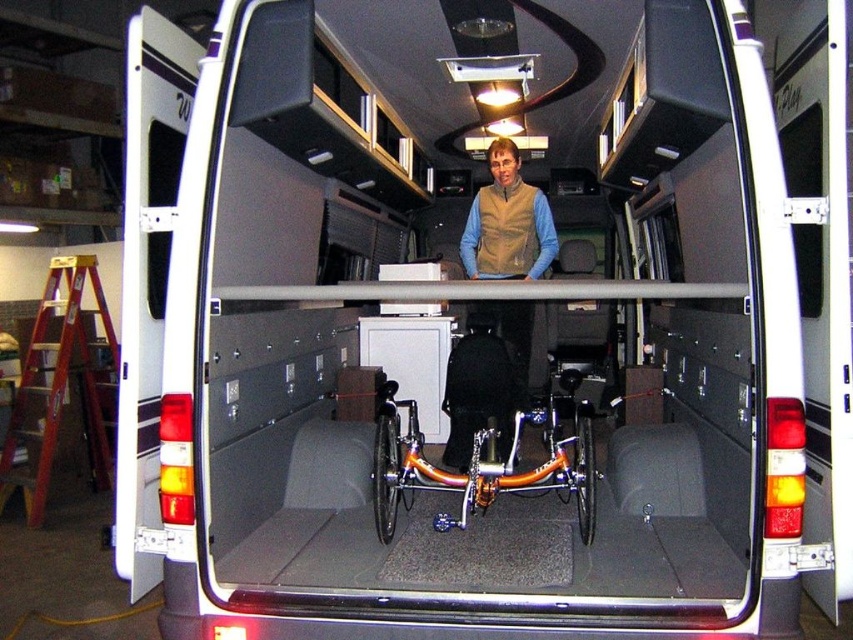
Question: Which point is farther to the camera?

Choices:
 (A) (492, 364)
 (B) (521, 248)
 (C) (68, 312)
 (D) (550, 474)

Answer: (C)

Question: Is red wood ladder at left above matte black wheelchair at center?

Choices:
 (A) yes
 (B) no

Answer: (B)

Question: Which point is farther from the camera taking this photo?

Choices:
 (A) (437, 472)
 (B) (483, 273)
 (C) (91, 403)
 (D) (509, 426)

Answer: (C)

Question: Does red wood ladder at left appear over matte black wheelchair at center?

Choices:
 (A) no
 (B) yes

Answer: (A)

Question: Can you confirm if red wood ladder at left is smaller than orange metallic bicycle at center?

Choices:
 (A) yes
 (B) no

Answer: (B)

Question: Which point appears closest to the camera in this image?

Choices:
 (A) (74, 305)
 (B) (532, 417)
 (C) (485, 419)

Answer: (B)